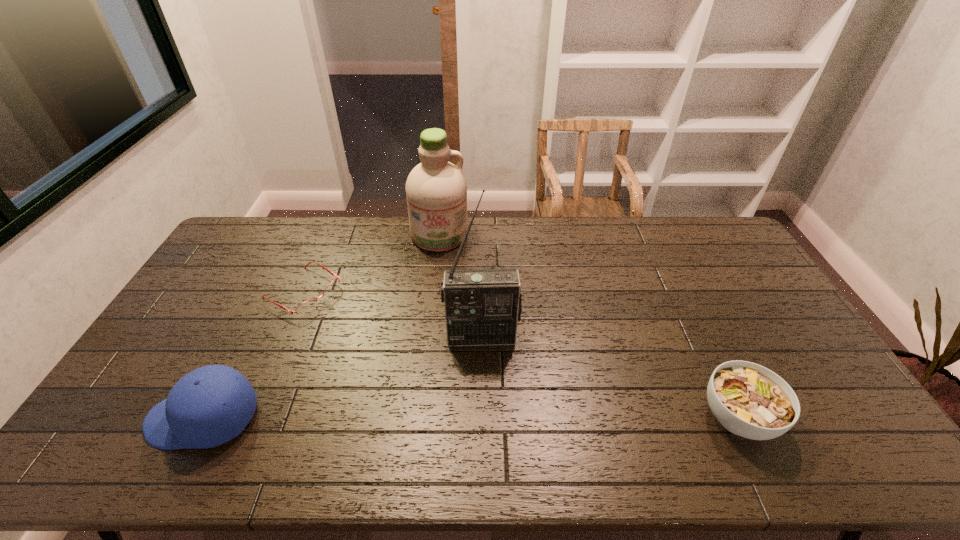
Locate an element on the screen. The height and width of the screenshot is (540, 960). free space on the desktop that is between the cap and the rightmost object and is positioned on the display of the radio receiver is located at coordinates (486, 418).

The height and width of the screenshot is (540, 960). In order to click on vacant space on the desktop that is between the third shortest object and the rightmost object and is positioned on the front label of the second tallest object in this screenshot , I will do `click(462, 418)`.

Where is `free space on the desktop that is between the cap and the fourth tallest object and is positioned on the lenses of the shortest object`? The image size is (960, 540). free space on the desktop that is between the cap and the fourth tallest object and is positioned on the lenses of the shortest object is located at coordinates (519, 418).